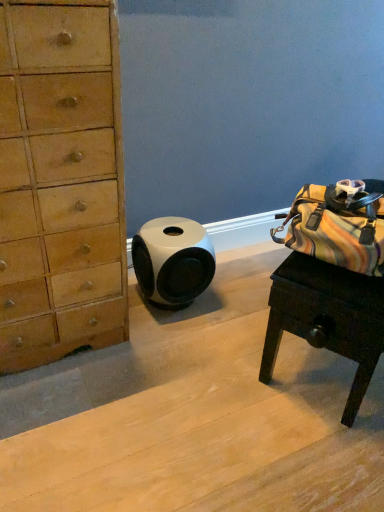
Question: Is white glossy speaker at center wider or thinner than wooden desk at right?

Choices:
 (A) wide
 (B) thin

Answer: (B)

Question: Is white glossy speaker at center taller or shorter than wooden desk at right?

Choices:
 (A) tall
 (B) short

Answer: (B)

Question: Is white glossy speaker at center inside or outside of wooden desk at right?

Choices:
 (A) outside
 (B) inside

Answer: (A)

Question: Choose the correct answer: Is wooden desk at right inside white glossy speaker at center or outside it?

Choices:
 (A) outside
 (B) inside

Answer: (A)

Question: From a real-world perspective, relative to white glossy speaker at center, is wooden desk at right vertically above or below?

Choices:
 (A) below
 (B) above

Answer: (B)

Question: From the image's perspective, is wooden desk at right positioned above or below white glossy speaker at center?

Choices:
 (A) above
 (B) below

Answer: (B)

Question: Is wooden desk at right taller or shorter than white glossy speaker at center?

Choices:
 (A) tall
 (B) short

Answer: (A)